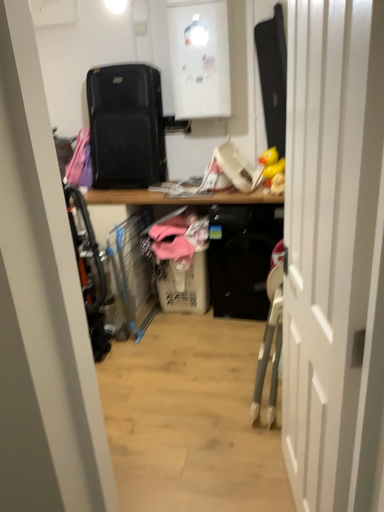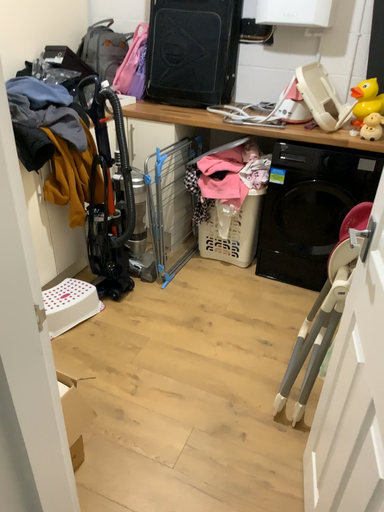
Question: Which way did the camera rotate in the video?

Choices:
 (A) rotated upward
 (B) rotated downward

Answer: (B)